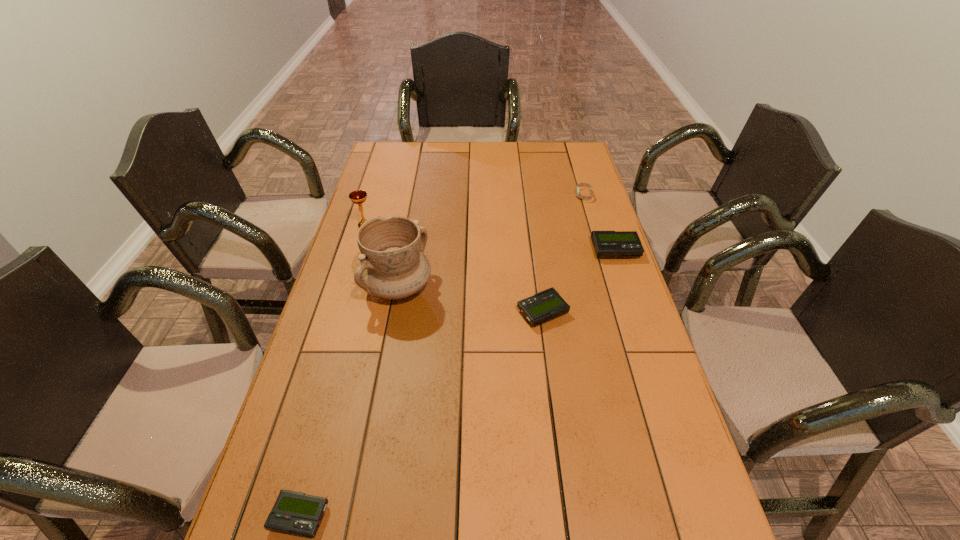
The width and height of the screenshot is (960, 540). I want to click on free location at the left edge, so click(x=355, y=337).

In the image, there is a desktop. Where is `vacant space at the right edge`? The image size is (960, 540). vacant space at the right edge is located at coordinates (696, 479).

At what (x,y) coordinates should I click in order to perform the action: click on vacant space at the far left corner. Please return your answer as a coordinate pair (x, y). This screenshot has height=540, width=960. Looking at the image, I should click on (392, 141).

This screenshot has height=540, width=960. In the image, there is a desktop. Identify the location of free space at the near left corner. (275, 494).

Locate an element on the screen. The height and width of the screenshot is (540, 960). vacant space at the far right corner of the desktop is located at coordinates (560, 168).

In the image, there is a desktop. Identify the location of vacant space at the near right corner. (700, 518).

The image size is (960, 540). In order to click on free space between the fifth shortest object and the fourth object from left to right in this screenshot , I will do (454, 271).

The height and width of the screenshot is (540, 960). Find the location of `free space that is in between the pottery and the farthest object`. free space that is in between the pottery and the farthest object is located at coordinates pyautogui.click(x=492, y=241).

Locate an element on the screen. empty location between the third object from right to left and the fourth nearest object is located at coordinates (579, 281).

Locate an element on the screen. The height and width of the screenshot is (540, 960). free space between the watch and the second tallest object is located at coordinates (474, 212).